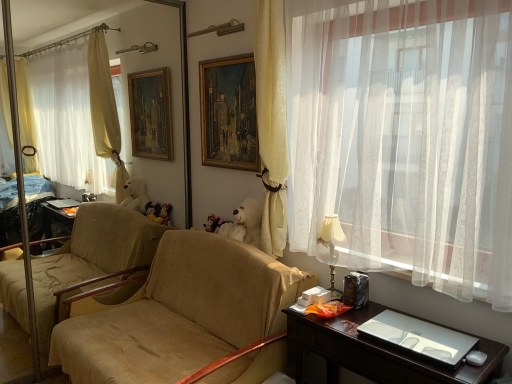
Question: Considering the positions of beige fabric couch at center and wooden oil painting at center in the image, is beige fabric couch at center taller or shorter than wooden oil painting at center?

Choices:
 (A) short
 (B) tall

Answer: (B)

Question: From a real-world perspective, is beige fabric couch at center physically located above or below wooden oil painting at center?

Choices:
 (A) above
 (B) below

Answer: (B)

Question: Which of these objects is positioned farthest from the yellow fabric curtain at center, the 2th curtain from the right?

Choices:
 (A) white plush teddy bear at center
 (B) shiny dark wood desk at lower right
 (C) velvet plush toy at center
 (D) wooden oil painting at center
 (E) white sheer curtain at right, the 1th curtain positioned from the right

Answer: (B)

Question: Which is farther from the white sheer curtain at right, the 1th curtain positioned from the right?

Choices:
 (A) white plush teddy bear at center
 (B) velvet plush toy at center
 (C) yellow fabric curtain at center, positioned as the first curtain in left-to-right order
 (D) beige fabric couch at center
 (E) creamy fabric lampshade at right

Answer: (B)